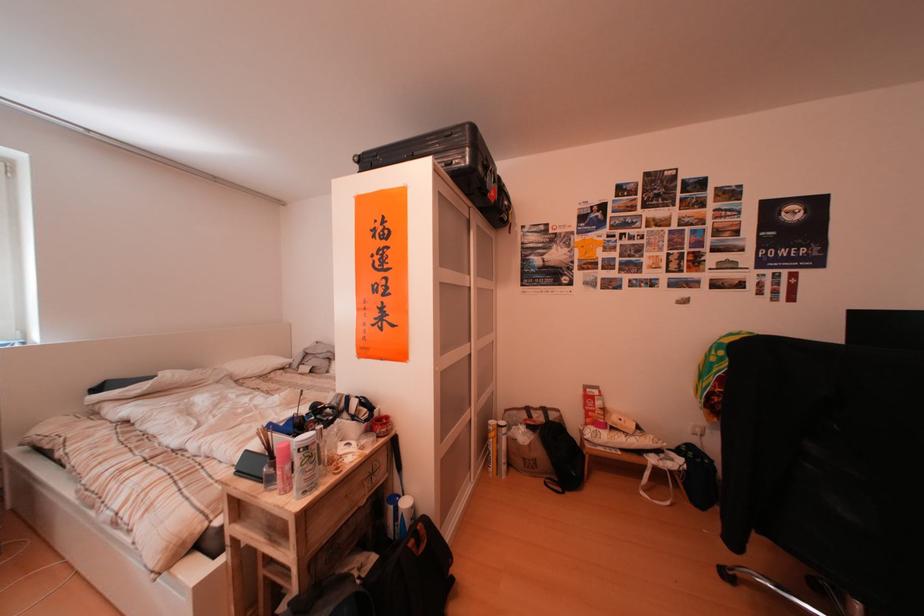
Find where to lift the black backpack. Please return your answer as a coordinate pair (x, y).

(411, 573)